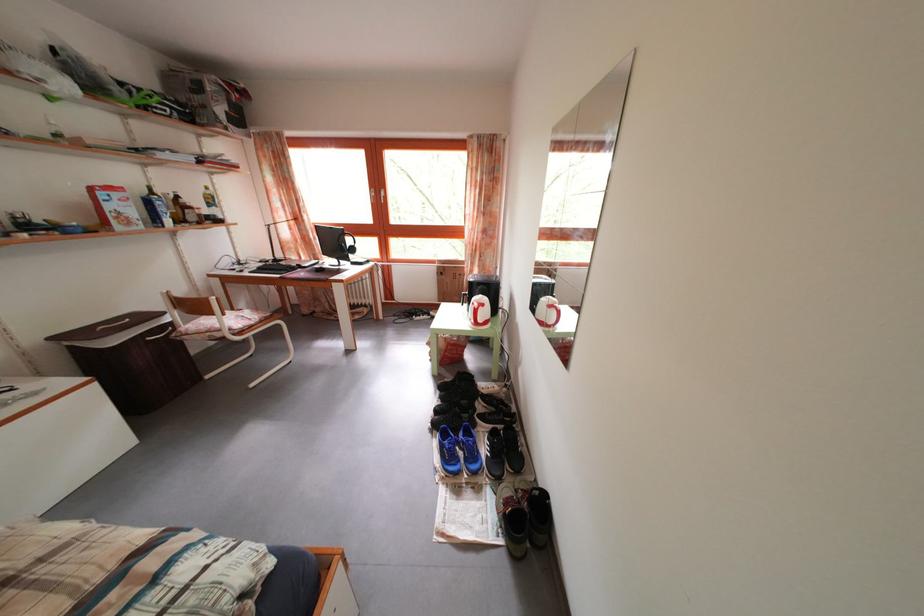
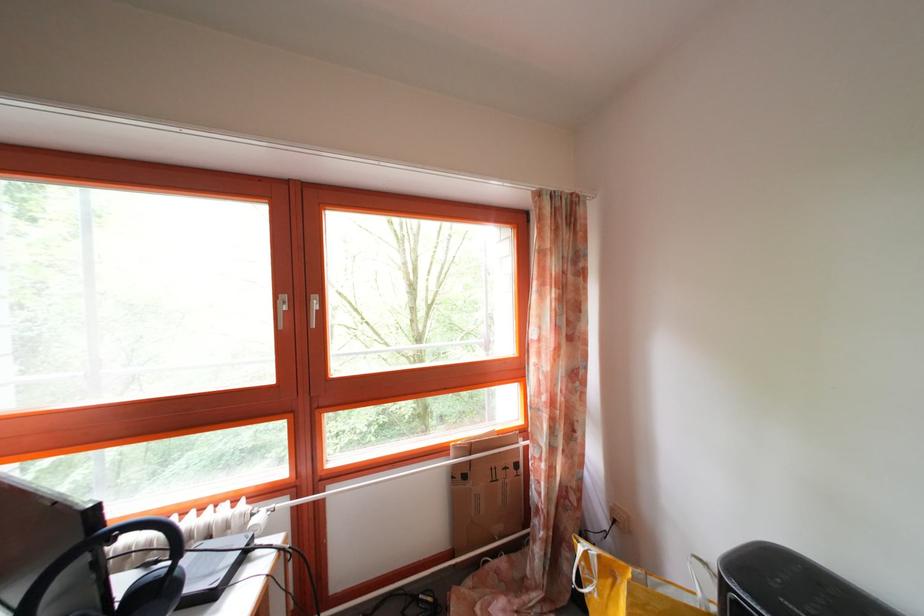
The point at (448, 281) is marked in the first image. Where is the corresponding point in the second image?

(472, 484)